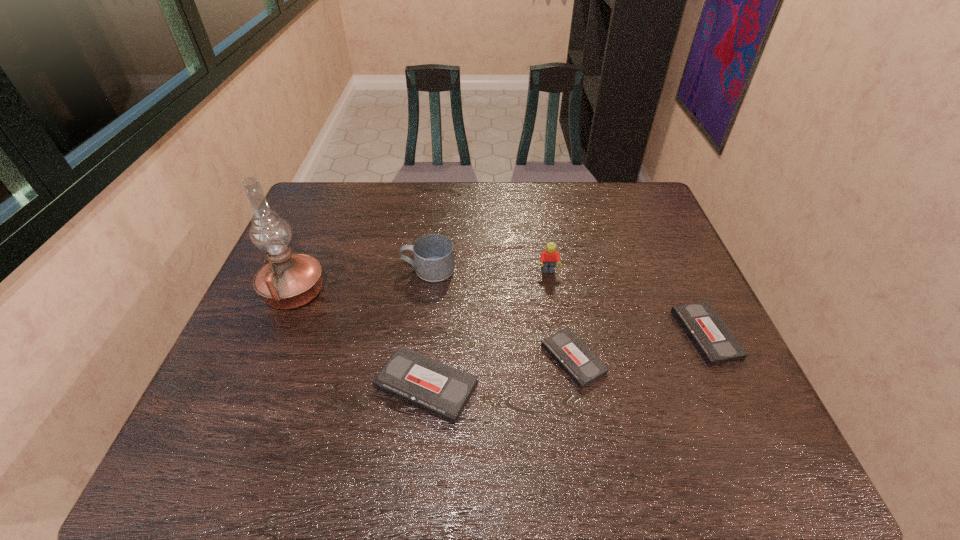
Please point a free position for a videotape on the left. Please provide its 2D coordinates. Your answer should be formatted as a tuple, i.e. [(x, y)], where the tuple contains the x and y coordinates of a point satisfying the conditions above.

[(262, 416)]